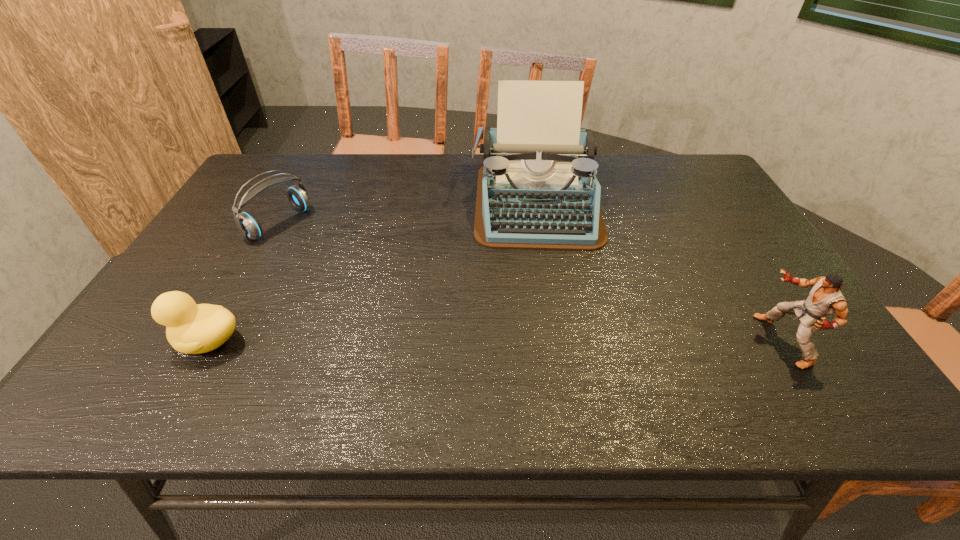
This screenshot has width=960, height=540. I want to click on vacant space located 0.210m on the ear cups of the headset, so click(x=348, y=266).

At what (x,y) coordinates should I click in order to perform the action: click on vacant space situated on the ear cups of the headset. Please return your answer as a coordinate pair (x, y). The width and height of the screenshot is (960, 540). Looking at the image, I should click on (335, 258).

The width and height of the screenshot is (960, 540). Find the location of `vacant area located on the ear cups of the headset`. vacant area located on the ear cups of the headset is located at coordinates (343, 262).

In order to click on free space located on the typing side of the typewriter in this screenshot , I will do `click(542, 264)`.

This screenshot has height=540, width=960. I want to click on vacant space located 0.150m on the typing side of the typewriter, so click(545, 291).

Find the location of a particular element. vacant point located on the typing side of the typewriter is located at coordinates (547, 315).

Where is `object situated at the far edge`? This screenshot has height=540, width=960. object situated at the far edge is located at coordinates (537, 190).

At what (x,y) coordinates should I click in order to perform the action: click on duck that is at the near edge. Please return your answer as a coordinate pair (x, y). The width and height of the screenshot is (960, 540). Looking at the image, I should click on (191, 328).

At what (x,y) coordinates should I click in order to perform the action: click on puncher that is positioned at the near edge. Please return your answer as a coordinate pair (x, y). This screenshot has width=960, height=540. Looking at the image, I should click on (825, 298).

Image resolution: width=960 pixels, height=540 pixels. In order to click on duck situated at the left edge in this screenshot , I will do `click(191, 328)`.